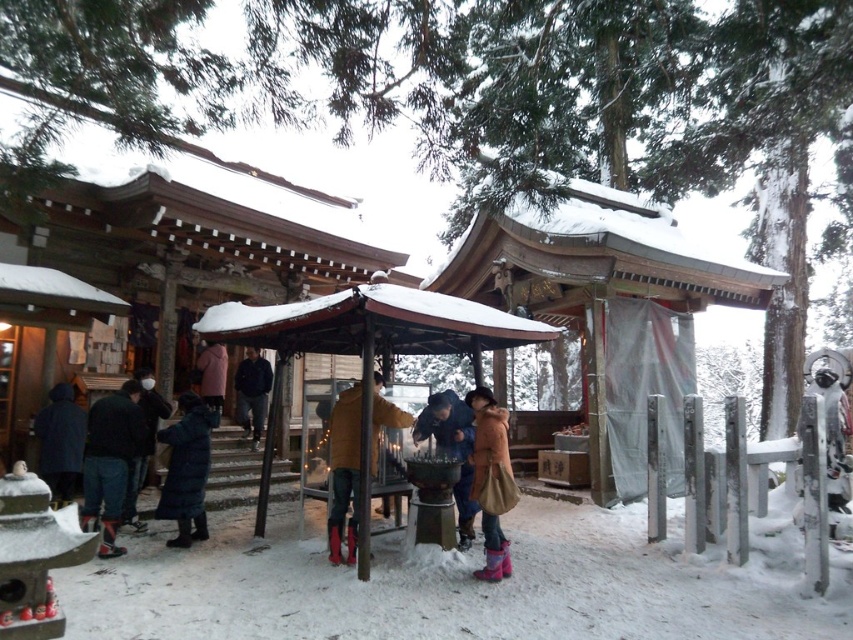
Question: Does wooden shrine at center have a lesser width compared to matte pink coat at center?

Choices:
 (A) no
 (B) yes

Answer: (A)

Question: Can you confirm if dark blue down jacket at center is thinner than blue denim jacket at center?

Choices:
 (A) no
 (B) yes

Answer: (B)

Question: Does yellow matte jacket at center have a smaller size compared to black matte jacket at center?

Choices:
 (A) no
 (B) yes

Answer: (B)

Question: Which object appears farthest from the camera in this image?

Choices:
 (A) dark blue jeans at left
 (B) wooden shrine at center
 (C) matte pink coat at center
 (D) brown fuzzy coat at center

Answer: (C)

Question: Which point is farther from the camera taking this photo?

Choices:
 (A) (338, 412)
 (B) (200, 381)
 (C) (193, 401)
 (D) (465, 435)

Answer: (B)

Question: Which object is farther from the camera taking this photo?

Choices:
 (A) matte pink coat at center
 (B) black matte jacket at center

Answer: (B)